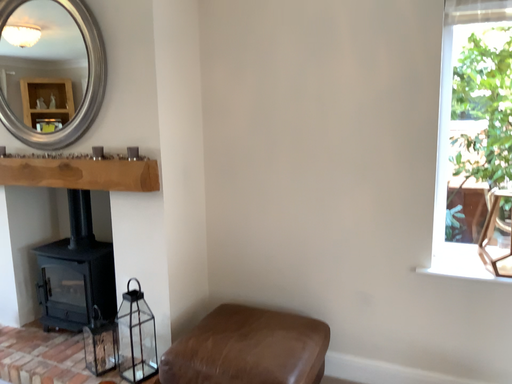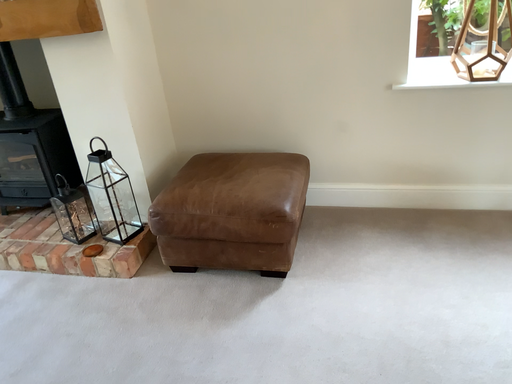
Question: How did the camera likely rotate when shooting the video?

Choices:
 (A) rotated right
 (B) rotated left

Answer: (A)